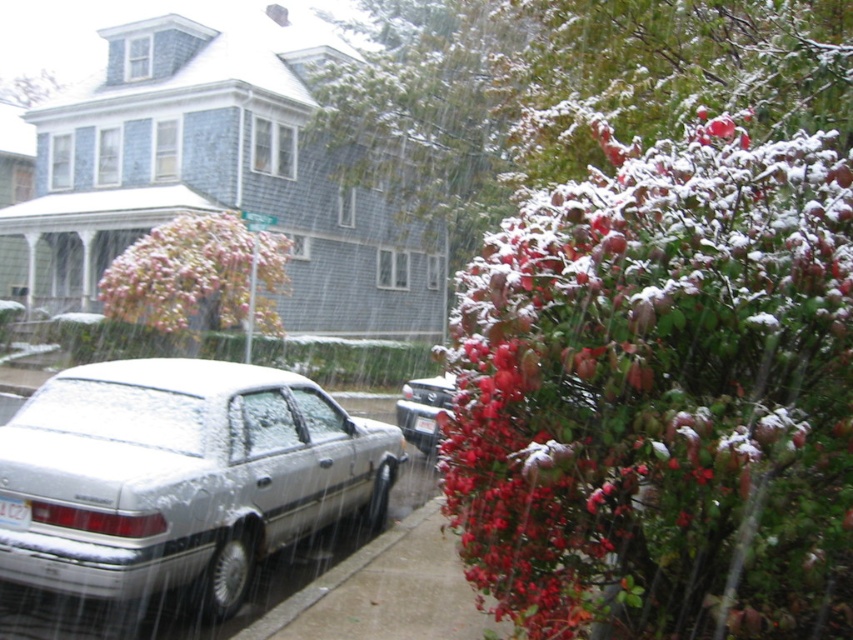
Question: Among these objects, which one is farthest from the camera?

Choices:
 (A) white plastic license plate at lower left
 (B) pink textured bush at upper left

Answer: (B)

Question: Is pink textured bush at upper left closer to the viewer compared to white plastic license plate at center?

Choices:
 (A) yes
 (B) no

Answer: (B)

Question: Can you confirm if satin silver sedan at center is positioned to the right of white plastic license plate at center?

Choices:
 (A) yes
 (B) no

Answer: (B)

Question: Which of the following is the farthest from the observer?

Choices:
 (A) pink textured bush at upper left
 (B) white plastic license plate at center

Answer: (A)

Question: Based on their relative distances, which object is farther from the satin silver sedan at center?

Choices:
 (A) white plastic license plate at lower left
 (B) gray concrete curb at lower left
 (C) silver metallic sedan at center

Answer: (C)

Question: Is satin silver sedan at center positioned behind white plastic license plate at center?

Choices:
 (A) yes
 (B) no

Answer: (B)